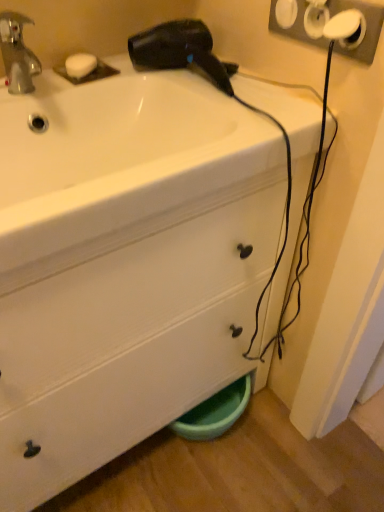
Locate an element on the screen. The width and height of the screenshot is (384, 512). free space to the right of white matte soap at upper left is located at coordinates (157, 74).